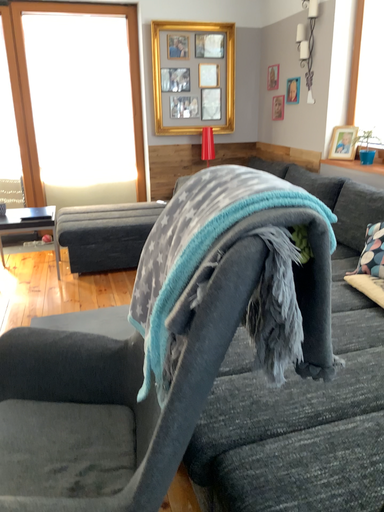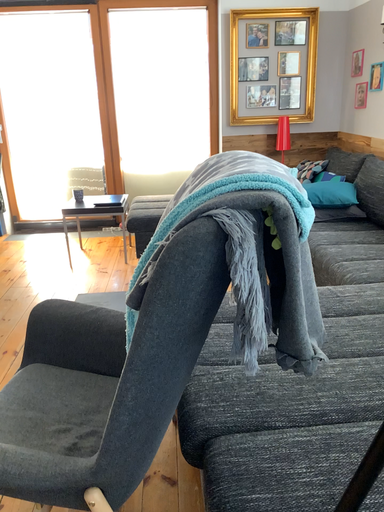
Question: How did the camera likely rotate when shooting the video?

Choices:
 (A) rotated left
 (B) rotated right

Answer: (A)